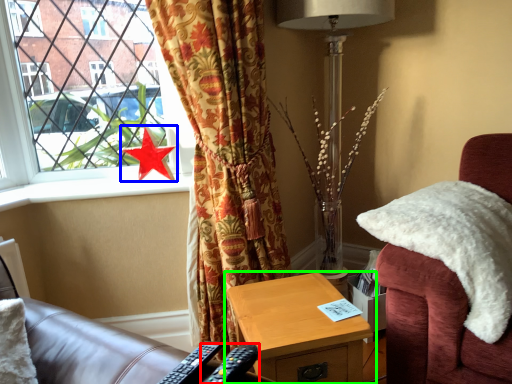
Question: Based on their relative distances, which object is nearer to remote control (highlighted by a red box)? Choose from star (highlighted by a blue box) and nightstand (highlighted by a green box).

Choices:
 (A) star
 (B) nightstand

Answer: (B)